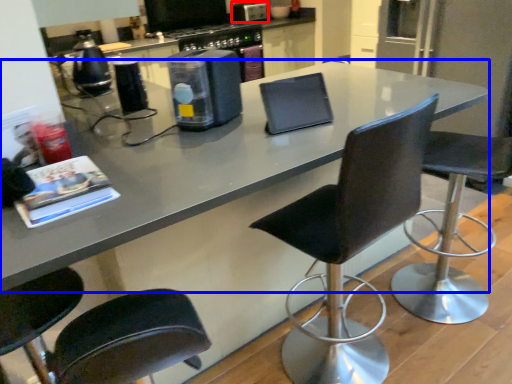
Question: Among these objects, which one is nearest to the camera, appliance (highlighted by a red box) or countertop (highlighted by a blue box)?

Choices:
 (A) appliance
 (B) countertop

Answer: (B)